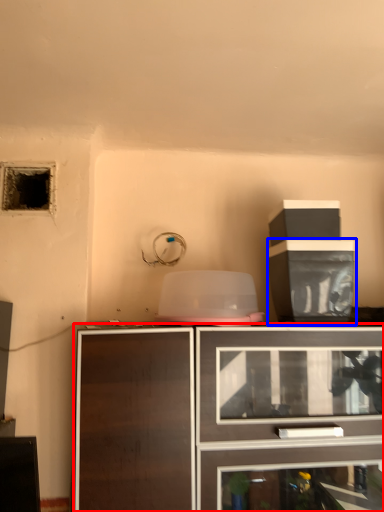
Question: Which point is closer to the camera, cabinetry (highlighted by a red box) or cabinetry (highlighted by a blue box)?

Choices:
 (A) cabinetry
 (B) cabinetry

Answer: (A)